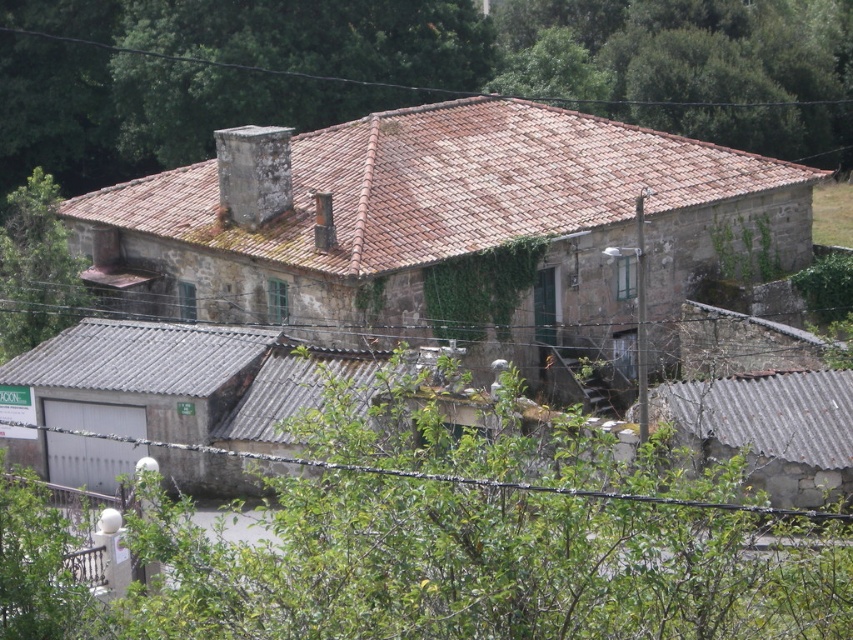
You are a drone operator trying to capture a photo of the brown tile roof at upper center and the green leafy tree at upper left. If you want to frame both objects in the same shot, which object should you position closer to the edge of the frame to ensure both are fully visible?

The green leafy tree at upper left should be positioned closer to the edge of the frame because the brown tile roof at upper center is wider than the green leafy tree at upper left, so it requires more space in the frame.

You are standing in front of the rustic stone building and want to take a photo of both the brown tile roof at upper center and the green leafy tree at upper left. Which object should you focus on first to ensure both are in the frame?

You should focus on the brown tile roof at upper center first because it is closer to you than the green leafy tree at upper left, so adjusting the camera to include it will also capture the tree in the background.